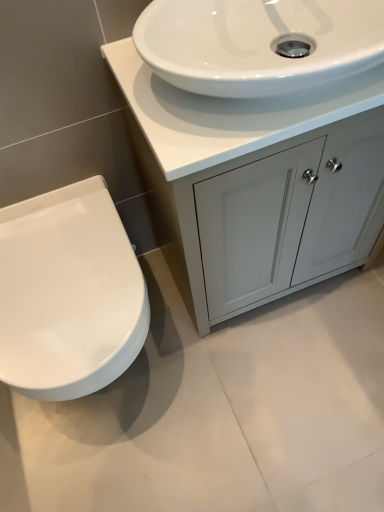
Question: Is white glossy sink at upper center looking in the opposite direction of white glossy toilet at left?

Choices:
 (A) yes
 (B) no

Answer: (B)

Question: Could you tell me if white glossy sink at upper center is facing white glossy toilet at left?

Choices:
 (A) no
 (B) yes

Answer: (A)

Question: Is the depth of white glossy sink at upper center greater than that of white glossy toilet at left?

Choices:
 (A) yes
 (B) no

Answer: (B)

Question: Is white glossy sink at upper center to the left of white glossy toilet at left from the viewer's perspective?

Choices:
 (A) yes
 (B) no

Answer: (B)

Question: Considering the relative sizes of white glossy sink at upper center and white glossy toilet at left in the image provided, is white glossy sink at upper center taller than white glossy toilet at left?

Choices:
 (A) no
 (B) yes

Answer: (A)

Question: Is white glossy toilet at left to the left or to the right of matte white cabinet at center in the image?

Choices:
 (A) left
 (B) right

Answer: (A)

Question: Considering the positions of point (52, 399) and point (185, 113), is point (52, 399) closer or farther from the camera than point (185, 113)?

Choices:
 (A) closer
 (B) farther

Answer: (B)

Question: Is white glossy toilet at left in front of or behind matte white cabinet at center in the image?

Choices:
 (A) front
 (B) behind

Answer: (B)

Question: Would you say white glossy toilet at left is inside or outside matte white cabinet at center?

Choices:
 (A) inside
 (B) outside

Answer: (B)

Question: From the image's perspective, relative to white glossy sink at upper center, is white glossy toilet at left above or below?

Choices:
 (A) below
 (B) above

Answer: (A)

Question: In terms of height, does white glossy toilet at left look taller or shorter compared to white glossy sink at upper center?

Choices:
 (A) short
 (B) tall

Answer: (B)

Question: Relative to white glossy sink at upper center, is white glossy toilet at left in front or behind?

Choices:
 (A) behind
 (B) front

Answer: (A)

Question: Considering the positions of point (82, 295) and point (125, 47), is point (82, 295) closer or farther from the camera than point (125, 47)?

Choices:
 (A) closer
 (B) farther

Answer: (B)

Question: Is point (241, 124) closer or farther from the camera than point (132, 326)?

Choices:
 (A) closer
 (B) farther

Answer: (A)

Question: From the image's perspective, relative to white glossy toilet at left, is white glossy sink at upper center above or below?

Choices:
 (A) above
 (B) below

Answer: (A)